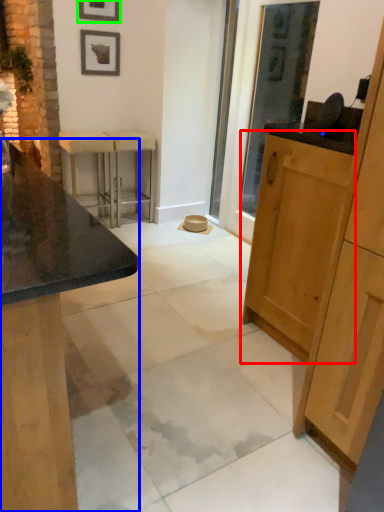
Question: Which object is positioned farthest from cabinetry (highlighted by a red box)? Select from cabinetry (highlighted by a blue box) and picture frame (highlighted by a green box).

Choices:
 (A) cabinetry
 (B) picture frame

Answer: (B)